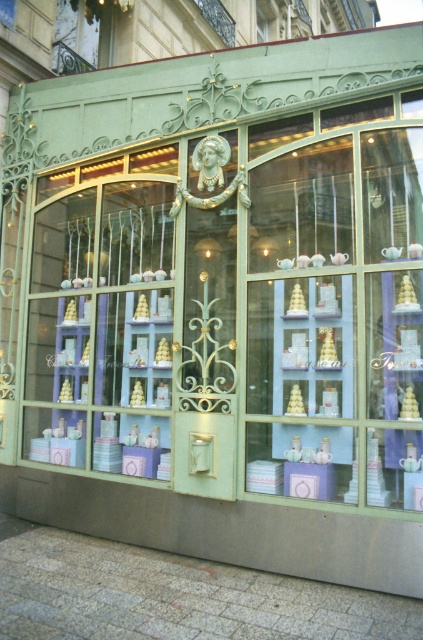
You are standing in front of the bakery shop and want to locate two specific points marked on the facade. The first point is at coordinates point [338,163] and the second is at point [82,58]. Which point is closer to you?

Point [338,163] is in front of point [82,58], so the first point is closer to you.

You are a delivery person trying to enter the bakery through the matte glass door at center. There is a metallic wrought iron at upper left above the door. Can you walk through the door without bending down?

The matte glass door at center has a greater height compared to metallic wrought iron at upper left, so the door is taller than the wrought iron above it. Since the door is taller, you should be able to walk through it without bending down.